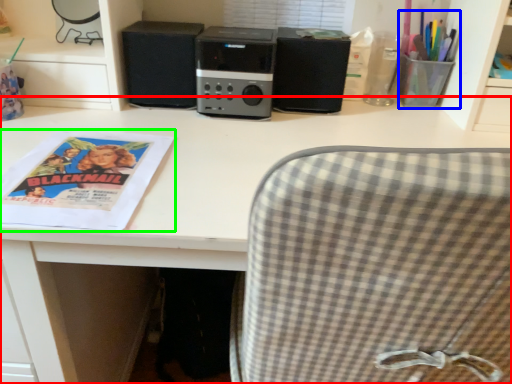
Question: Considering the real-world distances, which object is closest to desk (highlighted by a red box)? stationery (highlighted by a blue box) or magazine (highlighted by a green box).

Choices:
 (A) stationery
 (B) magazine

Answer: (B)